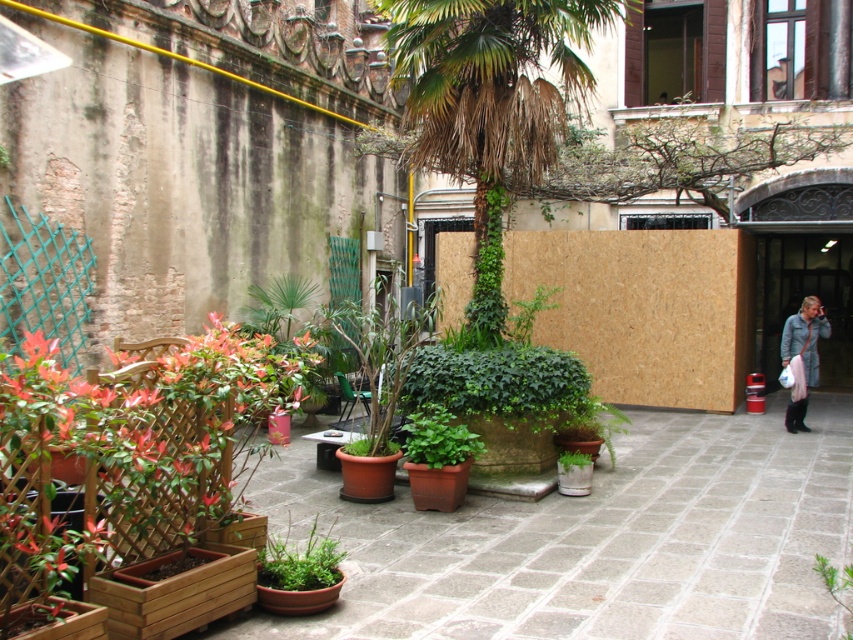
Question: Is green leafy palm tree at center bigger than light gray fabric coat at right?

Choices:
 (A) no
 (B) yes

Answer: (B)

Question: Which object is positioned closest to the light gray fabric coat at right?

Choices:
 (A) green leafy palm tree at center
 (B) green matte plant at center

Answer: (A)

Question: Which of the following is the closest to the observer?

Choices:
 (A) green matte plant at center
 (B) light gray fabric coat at right
 (C) green leafy palm tree at center

Answer: (A)

Question: Which of these objects is positioned closest to the green matte plant at center?

Choices:
 (A) light gray fabric coat at right
 (B) green leafy palm tree at center

Answer: (B)

Question: Observing the image, what is the correct spatial positioning of green leafy palm tree at center in reference to light gray fabric coat at right?

Choices:
 (A) right
 (B) left

Answer: (B)

Question: Does green leafy palm tree at center appear on the right side of green matte plant at center?

Choices:
 (A) no
 (B) yes

Answer: (B)